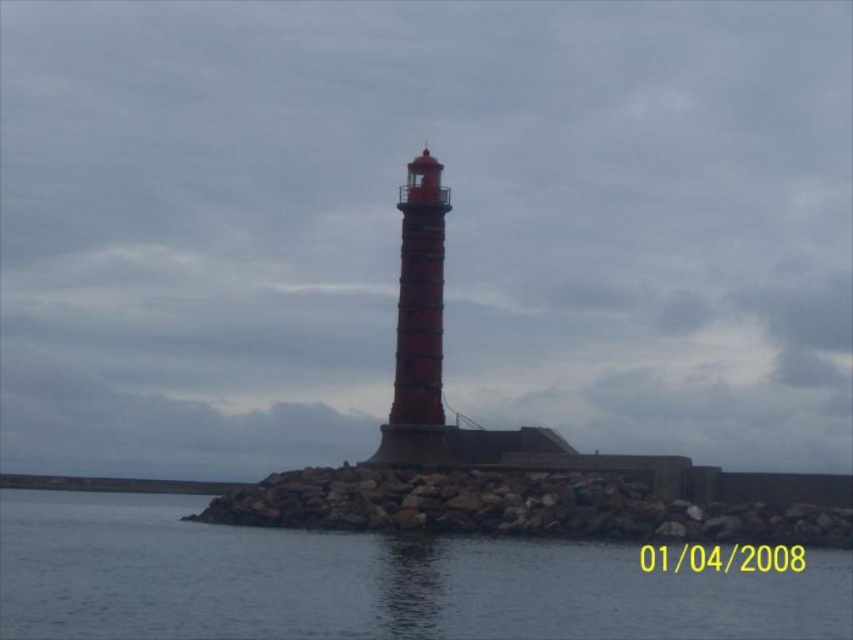
Question: Does transparent water at lower center have a larger size compared to rocky at center?

Choices:
 (A) no
 (B) yes

Answer: (B)

Question: Does rocky at center come behind red brick lighthouse at center?

Choices:
 (A) no
 (B) yes

Answer: (A)

Question: Which point is closer to the camera?

Choices:
 (A) (334, 593)
 (B) (219, 504)
 (C) (413, 384)

Answer: (A)

Question: Which point is farther from the camera taking this photo?

Choices:
 (A) (392, 404)
 (B) (85, 552)
 (C) (292, 522)

Answer: (A)

Question: Among these points, which one is farthest from the camera?

Choices:
 (A) (445, 452)
 (B) (756, 573)
 (C) (368, 492)

Answer: (A)

Question: Does transparent water at lower center appear over red brick lighthouse at center?

Choices:
 (A) no
 (B) yes

Answer: (A)